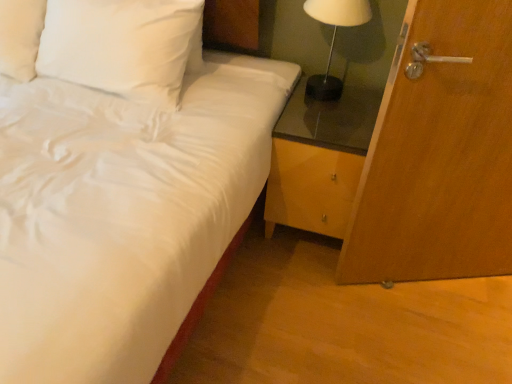
Question: From a real-world perspective, is white satin pillow at upper left physically located above or below wooden door at right?

Choices:
 (A) above
 (B) below

Answer: (A)

Question: Is white satin pillow at upper left bigger or smaller than wooden door at right?

Choices:
 (A) big
 (B) small

Answer: (A)

Question: Which of these objects is positioned closest to the wooden door at right?

Choices:
 (A) white satin bed at center
 (B) white glossy table lamp at upper right
 (C) white satin pillow at upper left

Answer: (B)

Question: Which object is the closest to the wooden door at right?

Choices:
 (A) white glossy table lamp at upper right
 (B) white satin pillow at upper left
 (C) white satin bed at center

Answer: (A)